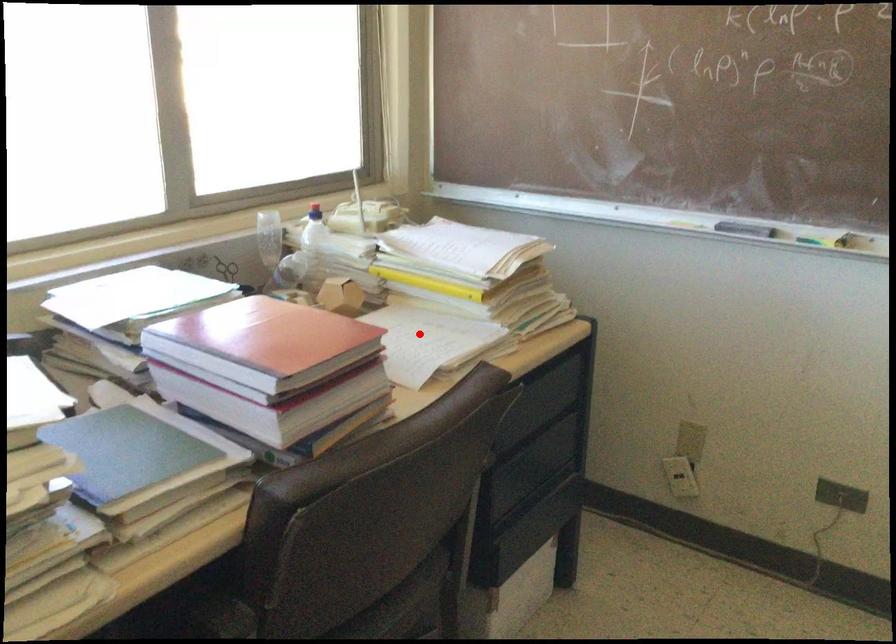
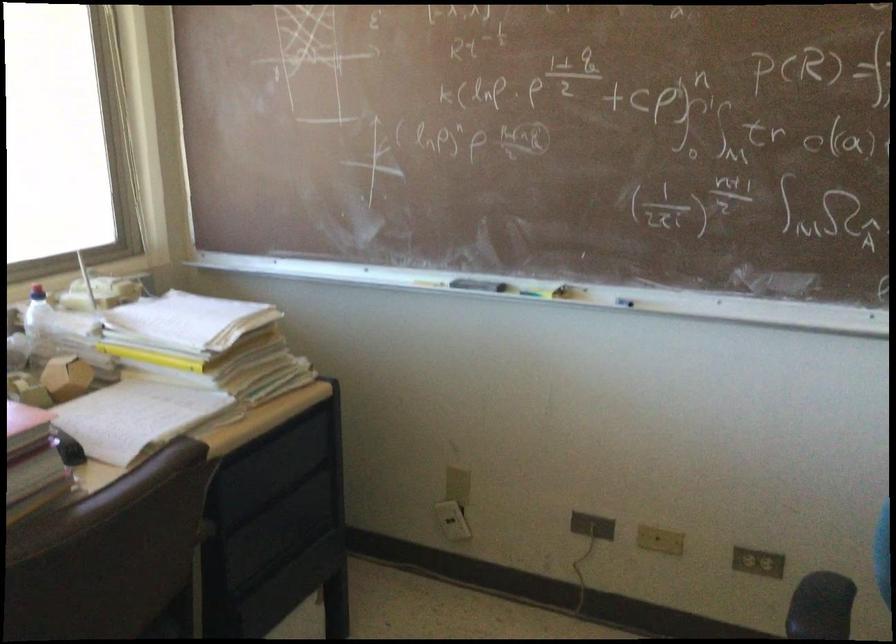
In the second image, find the point that corresponds to the highlighted location in the first image.

(135, 417)